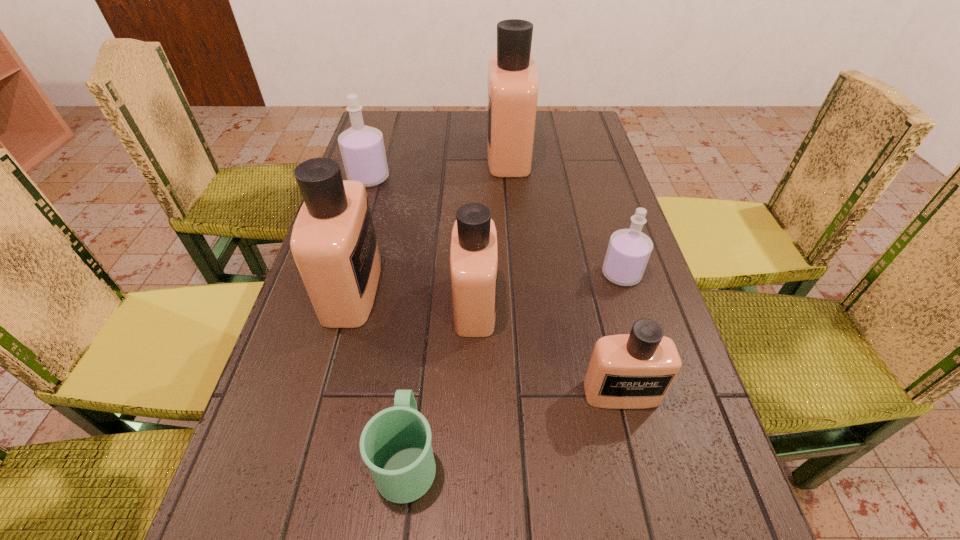
Find the location of a particular element. Image resolution: width=960 pixels, height=540 pixels. vacant space located 0.080m on the front label of the smallest beige perfume is located at coordinates (637, 456).

Identify the location of free spot located 0.080m on the side of the green mug with the handle. The image size is (960, 540). (417, 374).

The height and width of the screenshot is (540, 960). I want to click on free location located on the side of the green mug with the handle, so click(428, 280).

The image size is (960, 540). In order to click on vacant space situated 0.380m on the side of the green mug with the handle in this screenshot , I will do `click(430, 261)`.

At what (x,y) coordinates should I click in order to perform the action: click on object located in the far edge section of the desktop. Please return your answer as a coordinate pair (x, y). This screenshot has height=540, width=960. Looking at the image, I should click on (513, 81).

Where is `free space at the left edge of the desktop`? Image resolution: width=960 pixels, height=540 pixels. free space at the left edge of the desktop is located at coordinates (310, 537).

Find the location of `vacant region at the right edge of the desktop`. vacant region at the right edge of the desktop is located at coordinates (660, 324).

The image size is (960, 540). Identify the location of vacant region at the far right corner of the desktop. (585, 114).

Identify the location of free point between the nearer purple perfume and the third biggest beige perfume. (548, 289).

Image resolution: width=960 pixels, height=540 pixels. Find the location of `free spot between the second smallest beige perfume and the third smallest beige perfume`. free spot between the second smallest beige perfume and the third smallest beige perfume is located at coordinates (414, 296).